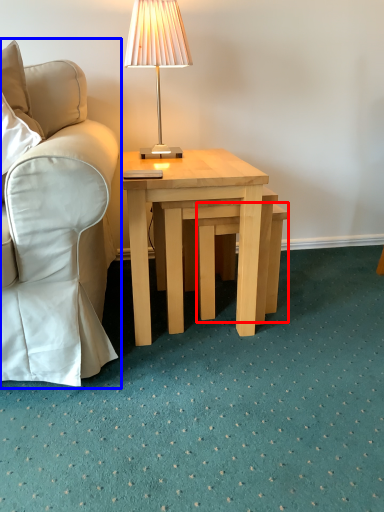
Question: Which of the following is the closest to the observer, stool (highlighted by a red box) or chair (highlighted by a blue box)?

Choices:
 (A) stool
 (B) chair

Answer: (B)